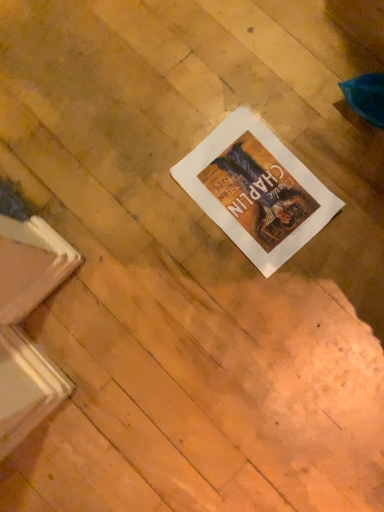
Find the location of a particular element. empty space that is ontop of white paper at center is located at coordinates (254, 187).